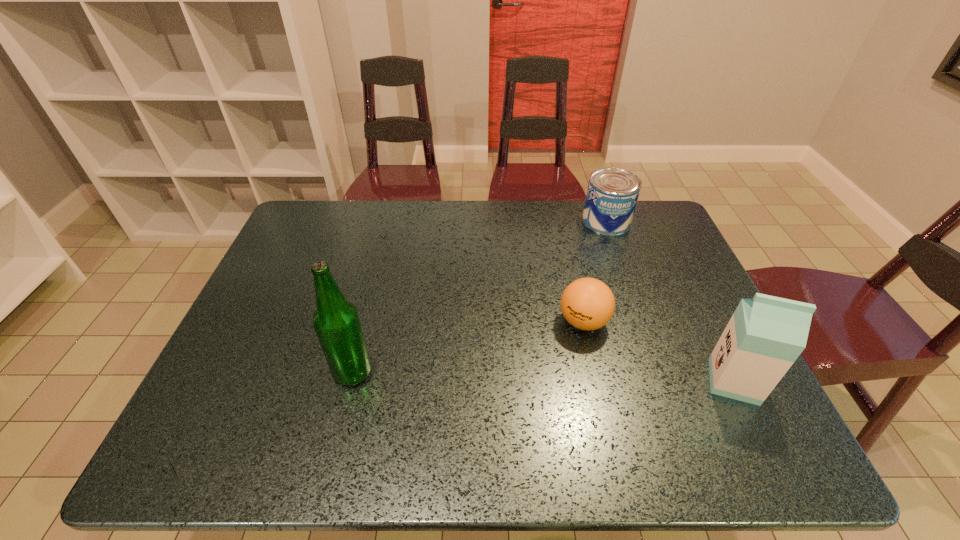
I want to click on the leftmost object, so click(336, 321).

Find the location of `beer bottle`. beer bottle is located at coordinates (336, 321).

This screenshot has height=540, width=960. I want to click on the rightmost object, so click(x=766, y=334).

Where is `the third shortest object`? The width and height of the screenshot is (960, 540). the third shortest object is located at coordinates (766, 334).

Find the location of `can`. can is located at coordinates (612, 194).

This screenshot has height=540, width=960. I want to click on the third object from left to right, so click(612, 194).

Image resolution: width=960 pixels, height=540 pixels. I want to click on ping-pong ball, so click(x=588, y=304).

Image resolution: width=960 pixels, height=540 pixels. In order to click on the shortest object in this screenshot , I will do `click(588, 304)`.

At what (x,y) coordinates should I click in order to perform the action: click on free region located 0.260m on the label of the beer bottle. Please return your answer as a coordinate pair (x, y). The width and height of the screenshot is (960, 540). Looking at the image, I should click on (222, 372).

Find the location of a particular element. free spot located 0.140m on the label of the beer bottle is located at coordinates (274, 372).